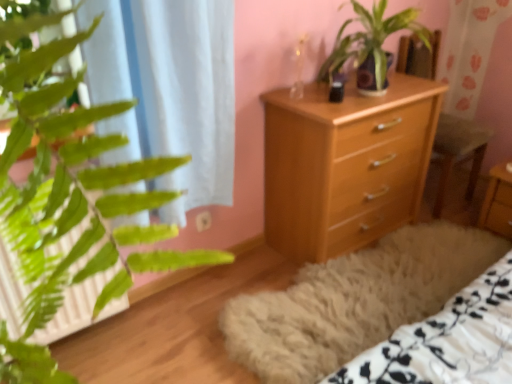
Image resolution: width=512 pixels, height=384 pixels. What do you see at coordinates (371, 40) in the screenshot?
I see `green leafy plant at center` at bounding box center [371, 40].

Image resolution: width=512 pixels, height=384 pixels. What do you see at coordinates (458, 152) in the screenshot?
I see `wooden armchair at center` at bounding box center [458, 152].

Measure the distance between wooden nightstand at center and camera.

They are 2.17 meters apart.

Find the location of `light wood chest of drawers at center`. light wood chest of drawers at center is located at coordinates (345, 165).

From a real-world perspective, who is located higher, green leafy plant at center or wooden nightstand at center?

green leafy plant at center, from a real-world perspective.

Would you say green leafy plant at center is to the left or to the right of wooden nightstand at center in the picture?

green leafy plant at center is positioned on wooden nightstand at center's left side.

Image resolution: width=512 pixels, height=384 pixels. I want to click on nightstand directly beneath the green leafy plant at center (from a real-world perspective), so click(x=498, y=202).

Which object is closer to the camera taking this photo, green leafy plant at center or wooden nightstand at center?

Positioned in front is green leafy plant at center.

Could you tell me if wooden nightstand at center is facing green leafy plant at center?

No, wooden nightstand at center is not facing towards green leafy plant at center.

How distant is wooden nightstand at center from green leafy plant at center?

The distance of wooden nightstand at center from green leafy plant at center is 37.49 inches.

Is wooden nightstand at center behind green leafy plant at center?

Yes.

Visually, is wooden nightstand at center positioned to the left or to the right of green leafy plant at center?

wooden nightstand at center is positioned on green leafy plant at center's right side.

Between wooden nightstand at center and white sheer curtain at left, which one has smaller width?

With smaller width is white sheer curtain at left.

Considering the positions of points (504, 168) and (136, 54), is point (504, 168) farther from camera compared to point (136, 54)?

Yes, it is.

Considering the sizes of objects wooden nightstand at center and white sheer curtain at left in the image provided, who is shorter, wooden nightstand at center or white sheer curtain at left?

Standing shorter between the two is wooden nightstand at center.

Would you say wooden nightstand at center is inside or outside white sheer curtain at left?

wooden nightstand at center is located beyond the bounds of white sheer curtain at left.

From the image's perspective, who appears lower, white sheer curtain at left or green leafy plant at center?

white sheer curtain at left appears lower in the image.

Which is behind, point (170, 131) or point (381, 56)?

Positioned behind is point (381, 56).

Does white sheer curtain at left come in front of green leafy plant at center?

Yes, white sheer curtain at left is closer to the camera.

Is white sheer curtain at left positioned with its back to green leafy plant at center?

No.

From a real-world perspective, is green leafy plant at center under white sheer curtain at left?

No, from a real-world perspective, green leafy plant at center is not below white sheer curtain at left.

Locate an element on the screen. Image resolution: width=512 pixels, height=384 pixels. curtain located underneath the green leafy plant at center (from a real-world perspective) is located at coordinates (185, 94).

From the image's perspective, is green leafy plant at center above or below white sheer curtain at left?

From the image's perspective, green leafy plant at center appears above white sheer curtain at left.

Considering the relative sizes of green leafy plant at center and white sheer curtain at left in the image provided, is green leafy plant at center shorter than white sheer curtain at left?

Indeed, green leafy plant at center has a lesser height compared to white sheer curtain at left.

Does wooden armchair at center have a lesser width compared to light wood chest of drawers at center?

No, wooden armchair at center is not thinner than light wood chest of drawers at center.

Is wooden armchair at center bigger or smaller than light wood chest of drawers at center?

Clearly, wooden armchair at center is smaller in size than light wood chest of drawers at center.

Does wooden armchair at center have a lesser height compared to light wood chest of drawers at center?

No, wooden armchair at center is not shorter than light wood chest of drawers at center.

From the image's perspective, is wooden armchair at center located above or below light wood chest of drawers at center?

wooden armchair at center is situated higher than light wood chest of drawers at center in the image.

Is light wood chest of drawers at center located within green leafy plant at center?

Actually, light wood chest of drawers at center is outside green leafy plant at center.

Is point (366, 34) positioned after point (337, 123)?

Yes, point (366, 34) is farther from viewer.

Can you confirm if green leafy plant at center is wider than light wood chest of drawers at center?

Yes, green leafy plant at center is wider than light wood chest of drawers at center.

Between green leafy plant at center and light wood chest of drawers at center, which one is positioned in front?

green leafy plant at center.

Where is `houseplant above the wooden nightstand at center (from the image's perspective)`? The image size is (512, 384). houseplant above the wooden nightstand at center (from the image's perspective) is located at coordinates (371, 40).

You are a GUI agent. You are given a task and a screenshot of the screen. Output one action in this format:
    pyautogui.click(x=<x>, y=<y>)
    Task: Click on the nightstand below the green leafy plant at center (from a real-world perspective)
    
    Given the screenshot: What is the action you would take?
    pyautogui.click(x=498, y=202)

When comparing their distances from light wood chest of drawers at center, does white sheer curtain at left or wooden nightstand at center seem closer?

Among the two, white sheer curtain at left is located nearer to light wood chest of drawers at center.

From the image, which object appears to be nearer to green leafy plant at center, wooden nightstand at center or white sheer curtain at left?

white sheer curtain at left.

Estimate the real-world distances between objects in this image. Which object is further from white sheer curtain at left, green leafy plant at center or wooden nightstand at center?

Among the two, wooden nightstand at center is located further to white sheer curtain at left.

Considering their positions, is wooden nightstand at center positioned closer to green leafy plant at center than light wood chest of drawers at center?

light wood chest of drawers at center is positioned closer to the anchor green leafy plant at center.

From the image, which object appears to be nearer to wooden nightstand at center, light wood chest of drawers at center or white sheer curtain at left?

Among the two, light wood chest of drawers at center is located nearer to wooden nightstand at center.

Considering their positions, is wooden armchair at center positioned further to white sheer curtain at left than wooden nightstand at center?

wooden nightstand at center is positioned further to the anchor white sheer curtain at left.

Which object lies further to the anchor point wooden armchair at center, wooden nightstand at center or green leafy plant at center?

Among the two, green leafy plant at center is located further to wooden armchair at center.

When comparing their distances from white sheer curtain at left, does light wood chest of drawers at center or green leafy plant at center seem further?

Among the two, green leafy plant at center is located further to white sheer curtain at left.

This screenshot has width=512, height=384. In order to click on armchair between green leafy plant at center and wooden nightstand at center from left to right in this screenshot , I will do `click(458, 152)`.

Where is `houseplant located between white sheer curtain at left and wooden armchair at center in the left-right direction`? The height and width of the screenshot is (384, 512). houseplant located between white sheer curtain at left and wooden armchair at center in the left-right direction is located at coordinates (371, 40).

At what (x,y) coordinates should I click in order to perform the action: click on the chest of drawers situated between white sheer curtain at left and wooden nightstand at center from left to right. Please return your answer as a coordinate pair (x, y). The image size is (512, 384). Looking at the image, I should click on point(345,165).

This screenshot has height=384, width=512. I want to click on houseplant between light wood chest of drawers at center and wooden armchair at center from left to right, so click(x=371, y=40).